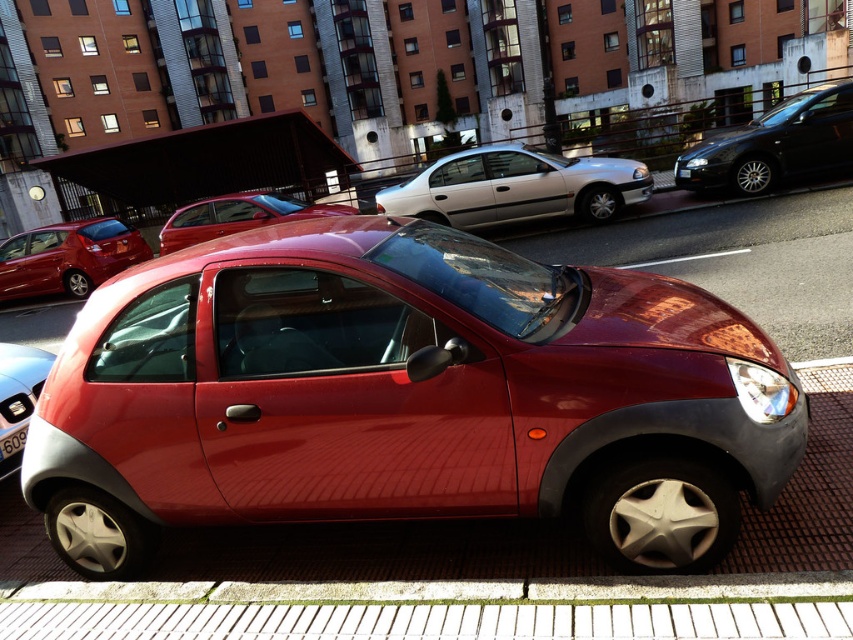
Can you confirm if glossy red car at center is positioned above shiny silver car at lower left?

Correct, glossy red car at center is located above shiny silver car at lower left.

Between glossy red car at center and shiny silver car at lower left, which one has more height?

glossy red car at center

You are a GUI agent. You are given a task and a screenshot of the screen. Output one action in this format:
    pyautogui.click(x=<x>, y=<y>)
    Task: Click on the glossy red car at center
    The image size is (853, 640).
    Given the screenshot: What is the action you would take?
    pyautogui.click(x=236, y=216)

Does glossy black sedan at upper right have a lesser height compared to glossy red hatchback at left?

Yes, glossy black sedan at upper right is shorter than glossy red hatchback at left.

Does glossy black sedan at upper right have a lesser width compared to glossy red hatchback at left?

Yes, glossy black sedan at upper right is thinner than glossy red hatchback at left.

Locate an element on the screen. The height and width of the screenshot is (640, 853). glossy black sedan at upper right is located at coordinates (775, 144).

Which is more to the left, glossy red hatchback at left or glossy red car at center?

glossy red hatchback at left is more to the left.

Does glossy red hatchback at left have a greater height compared to glossy red car at center?

Yes, glossy red hatchback at left is taller than glossy red car at center.

Locate an element on the screen. Image resolution: width=853 pixels, height=640 pixels. glossy red hatchback at left is located at coordinates (68, 257).

At what (x,y) coordinates should I click in order to perform the action: click on glossy red hatchback at left. Please return your answer as a coordinate pair (x, y). This screenshot has height=640, width=853. Looking at the image, I should click on (68, 257).